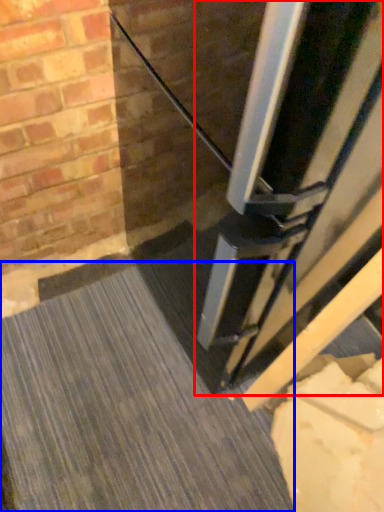
Question: Which object appears farthest to the camera in this image, door (highlighted by a red box) or concrete (highlighted by a blue box)?

Choices:
 (A) door
 (B) concrete

Answer: (B)